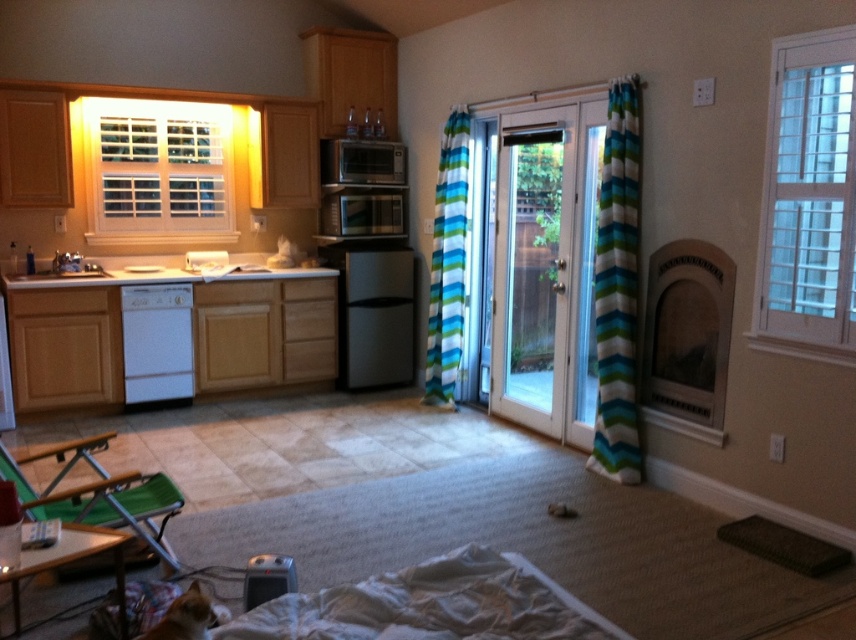
Question: Based on their relative distances, which object is nearer to the green fabric chair at lower left?

Choices:
 (A) transparent glass screen door at center
 (B) satin silver microwave at upper center
 (C) white glossy sink at left
 (D) black matte mini fridge at center

Answer: (C)

Question: Does green fabric chair at lower left appear on the right side of white glossy sink at left?

Choices:
 (A) yes
 (B) no

Answer: (A)

Question: Which of the following is the farthest from the observer?

Choices:
 (A) white textured glass door at upper right
 (B) satin silver microwave at upper center
 (C) white glossy dishwasher at center

Answer: (B)

Question: Is white glossy dishwasher at center further to camera compared to satin silver microwave at upper center?

Choices:
 (A) yes
 (B) no

Answer: (B)

Question: Is the position of striped fabric curtain at center less distant than that of satin silver microwave at upper center?

Choices:
 (A) yes
 (B) no

Answer: (A)

Question: Among these objects, which one is farthest from the camera?

Choices:
 (A) blue striped curtain at center
 (B) satin silver microwave at center
 (C) black matte mini fridge at center

Answer: (B)